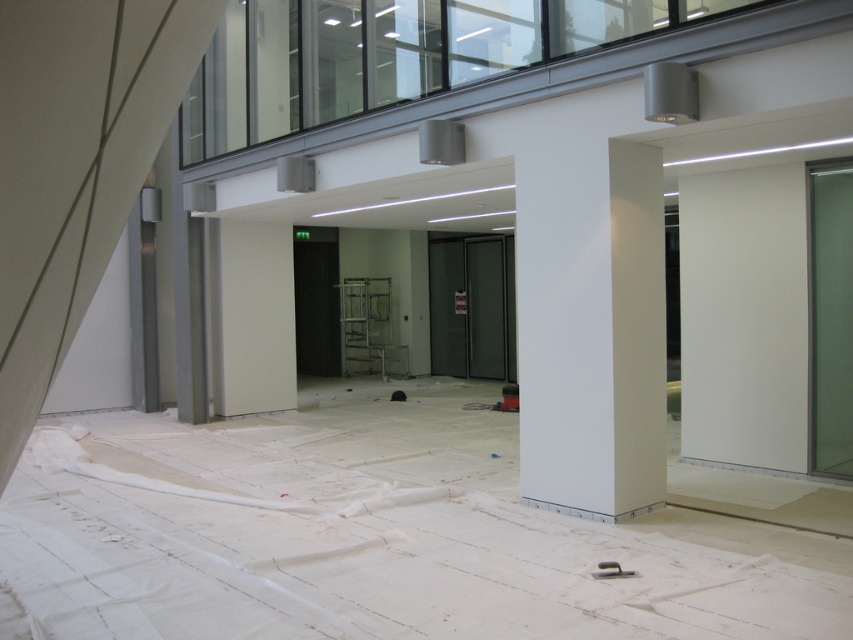
You are a delivery person trying to bring a large package through the space. The package is wider than the green frosted glass door at right. Can you maneuver it around the white smooth column at center?

The white smooth column at center is wider than the green frosted glass door at right. Since the package is wider than the door, it will also be wider than the column, making it difficult to maneuver around the column.

You are a delivery person trying to locate the correct entrance. You see the green frosted glass door at right and the transparent glass door at center. Which door is smaller in size?

The green frosted glass door at right has a smaller size compared to the transparent glass door at center, so the green frosted glass door at right is the smaller one.

You are standing in the center of the room and want to move towards the staircase on the left. Is the white smooth column at center in your way?

The white smooth column at center is located at point [590,326], which is directly in front of you, so it would block your path to the staircase on the left.